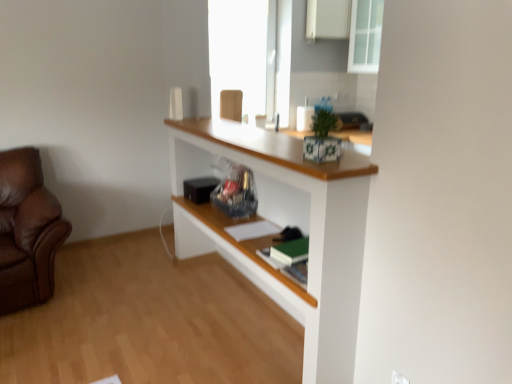
This screenshot has height=384, width=512. Describe the element at coordinates (328, 19) in the screenshot. I see `white matte cabinet at upper center` at that location.

Measure the distance between white matte book at center, which ranks as the first book in back-to-front order, and camera.

white matte book at center, which ranks as the first book in back-to-front order, is 2.32 meters from camera.

In order to click on white painted wood shelf at center in this screenshot , I will do `click(285, 219)`.

In the scene shown: Is green matte book at center, which appears as the second book when viewed from the top, at the right side of white matte book at center, which ranks as the first book in back-to-front order?

Correct, you'll find green matte book at center, which appears as the second book when viewed from the top, to the right of white matte book at center, which ranks as the first book in back-to-front order.

Could you tell me if green matte book at center, acting as the 2th book starting from the back, is turned towards white matte book at center, which ranks as the first book in back-to-front order?

No, green matte book at center, acting as the 2th book starting from the back, is not turned towards white matte book at center, which ranks as the first book in back-to-front order.

Which of these two, green matte book at center, placed as the first book when sorted from front to back, or white matte book at center, the 1th book from the top, is thinner?

Thinner between the two is green matte book at center, placed as the first book when sorted from front to back.

Which is nearer, (279, 261) or (250, 224)?

Point (279, 261).

From a real-world perspective, who is located higher, white matte book at center, the 1th book from the top, or white plastic electric outlet at lower right?

white matte book at center, the 1th book from the top, is physically above.

Is point (267, 225) closer or farther from the camera than point (397, 380)?

Point (267, 225) appears to be farther away from the viewer than point (397, 380).

Is white matte book at center, which ranks as the first book in back-to-front order, touching white plastic electric outlet at lower right?

No, white matte book at center, which ranks as the first book in back-to-front order, is not next to white plastic electric outlet at lower right.

Starting from the white plastic electric outlet at lower right, which book is the 2nd one to the left? Please provide its 2D coordinates.

[(252, 230)]

Which of these two, white matte cabinet at upper center or white painted wood shelf at center, is thinner?

With smaller width is white matte cabinet at upper center.

From a real-world perspective, which object stands above the other?

white matte cabinet at upper center, from a real-world perspective.

Is white painted wood shelf at center in front of white matte book at center, the 1th book from the top?

Yes, the depth of white painted wood shelf at center is less than that of white matte book at center, the 1th book from the top.

Is white painted wood shelf at center taller than white matte book at center, which ranks as the 2th book in front-to-back order?

Yes.

From a real-world perspective, who is located lower, white painted wood shelf at center or white matte book at center, which ranks as the first book in back-to-front order?

white matte book at center, which ranks as the first book in back-to-front order, from a real-world perspective.

Could you measure the distance between white painted wood shelf at center and white matte book at center, which ranks as the first book in back-to-front order?

The distance of white painted wood shelf at center from white matte book at center, which ranks as the first book in back-to-front order, is 48.46 centimeters.

Is white painted wood shelf at center touching white matte cabinet at upper center?

No, white painted wood shelf at center is not making contact with white matte cabinet at upper center.

Considering the positions of objects white painted wood shelf at center and white matte cabinet at upper center in the image provided, who is more to the right, white painted wood shelf at center or white matte cabinet at upper center?

From the viewer's perspective, white matte cabinet at upper center appears more on the right side.

Does white painted wood shelf at center contain white matte cabinet at upper center?

Actually, white matte cabinet at upper center is outside white painted wood shelf at center.

Is white painted wood shelf at center wider than white matte cabinet at upper center?

Yes, white painted wood shelf at center is wider than white matte cabinet at upper center.

Between green matte book at center, acting as the 2th book starting from the back, and white plastic electric outlet at lower right, which one has less height?

Standing shorter between the two is green matte book at center, acting as the 2th book starting from the back.

Between point (283, 250) and point (394, 383), which one is positioned in front?

The point (394, 383) is closer.

Is green matte book at center, positioned as the 1th book in bottom-to-top order, placed right next to white plastic electric outlet at lower right?

green matte book at center, positioned as the 1th book in bottom-to-top order, and white plastic electric outlet at lower right are not in contact.

Does point (392, 379) come farther from viewer compared to point (296, 253)?

No, it is in front of (296, 253).

Could you tell me if white plastic electric outlet at lower right is turned towards green matte book at center, positioned as the 1th book in bottom-to-top order?

No, white plastic electric outlet at lower right does not turn towards green matte book at center, positioned as the 1th book in bottom-to-top order.

Is the surface of white plastic electric outlet at lower right in direct contact with green matte book at center, positioned as the 1th book in bottom-to-top order?

No, white plastic electric outlet at lower right is not with green matte book at center, positioned as the 1th book in bottom-to-top order.

From the image's perspective, is white plastic electric outlet at lower right located above green matte book at center, placed as the first book when sorted from front to back?

No.

The width and height of the screenshot is (512, 384). In order to click on book on the left of green matte book at center, placed as the first book when sorted from front to back in this screenshot , I will do `click(252, 230)`.

Identify the location of book that is the 2nd one when counting backward from the white plastic electric outlet at lower right. (252, 230).

From the image, which object appears to be nearer to green matte book at center, acting as the 2th book starting from the back, white painted wood shelf at center or transparent glass cabinet at upper right?

white painted wood shelf at center is closer to green matte book at center, acting as the 2th book starting from the back.

Estimate the real-world distances between objects in this image. Which object is closer to white plastic electric outlet at lower right, white painted wood shelf at center or green matte book at center, placed as the first book when sorted from front to back?

Based on the image, green matte book at center, placed as the first book when sorted from front to back, appears to be nearer to white plastic electric outlet at lower right.

Estimate the real-world distances between objects in this image. Which object is closer to white matte cabinet at upper center, green matte book at center, positioned as the 1th book in bottom-to-top order, or transparent glass cabinet at upper right?

transparent glass cabinet at upper right lies closer to white matte cabinet at upper center than the other object.

Estimate the real-world distances between objects in this image. Which object is further from transparent glass cabinet at upper right, white matte book at center, which ranks as the first book in back-to-front order, or white painted wood shelf at center?

white matte book at center, which ranks as the first book in back-to-front order, is further to transparent glass cabinet at upper right.

From the image, which object appears to be nearer to white matte cabinet at upper center, transparent glass cabinet at upper right or white plastic electric outlet at lower right?

The object closer to white matte cabinet at upper center is transparent glass cabinet at upper right.

Based on the photo, from the image, which object appears to be nearer to white matte cabinet at upper center, white plastic electric outlet at lower right or green matte book at center, placed as the first book when sorted from front to back?

Based on the image, green matte book at center, placed as the first book when sorted from front to back, appears to be nearer to white matte cabinet at upper center.

Estimate the real-world distances between objects in this image. Which object is closer to white plastic electric outlet at lower right, white matte cabinet at upper center or white painted wood shelf at center?

Among the two, white painted wood shelf at center is located nearer to white plastic electric outlet at lower right.

Based on their spatial positions, is white plastic electric outlet at lower right or white painted wood shelf at center closer to green matte book at center, acting as the 2th book starting from the back?

white painted wood shelf at center is closer to green matte book at center, acting as the 2th book starting from the back.

Where is `glass door between white painted wood shelf at center and white matte cabinet at upper center in the front-back direction`? The height and width of the screenshot is (384, 512). glass door between white painted wood shelf at center and white matte cabinet at upper center in the front-back direction is located at coordinates (365, 36).

Image resolution: width=512 pixels, height=384 pixels. What are the coordinates of `glass door between white matte cabinet at upper center and white matte book at center, which ranks as the 2th book in front-to-back order, in the vertical direction` in the screenshot? It's located at (365, 36).

The image size is (512, 384). Find the location of `electric outlet positioned between white painted wood shelf at center and white matte cabinet at upper center from near to far`. electric outlet positioned between white painted wood shelf at center and white matte cabinet at upper center from near to far is located at coordinates (399, 378).

Where is `book between white plastic electric outlet at lower right and white matte book at center, placed as the second book when sorted from bottom to top, along the z-axis`? book between white plastic electric outlet at lower right and white matte book at center, placed as the second book when sorted from bottom to top, along the z-axis is located at coordinates (291, 251).